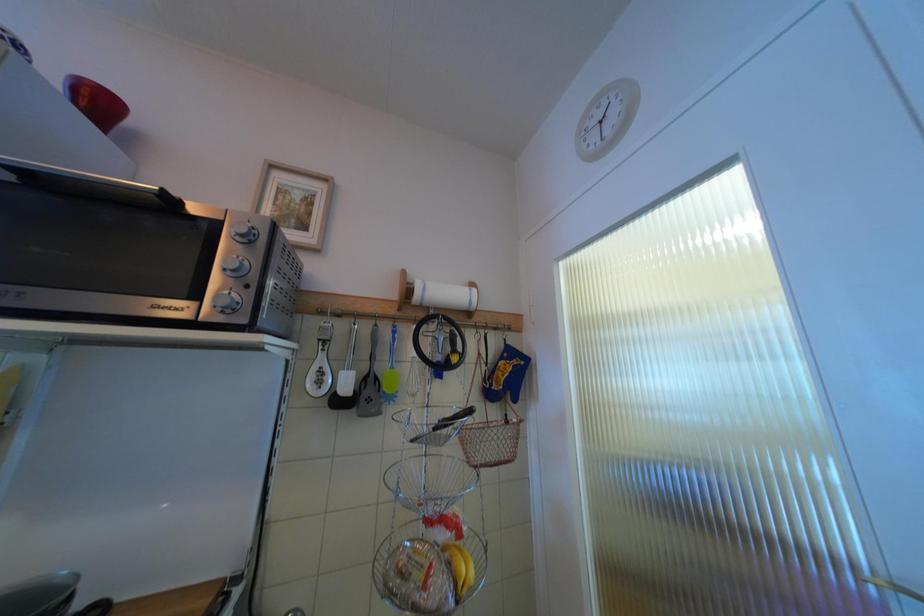
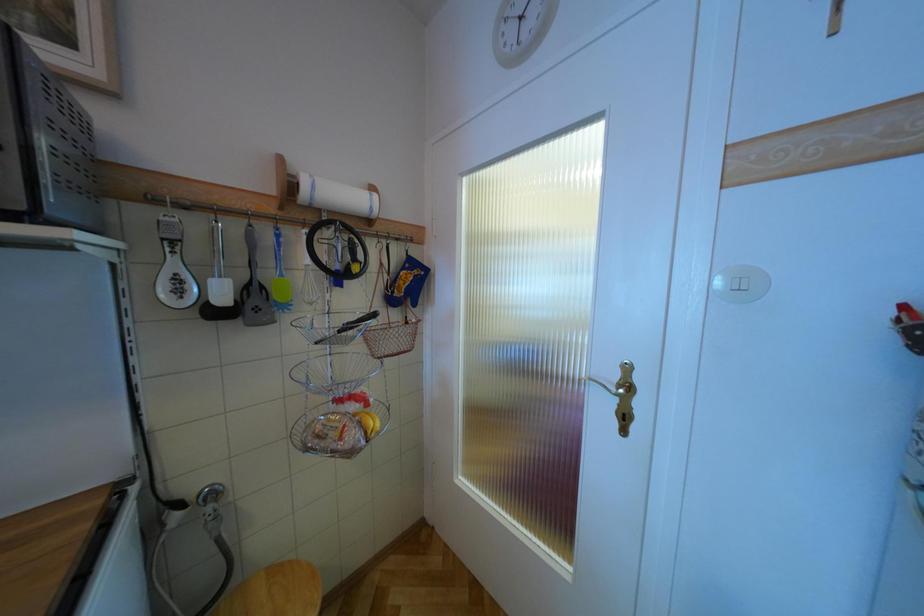
First-person continuous shooting, in which direction is the camera rotating?

The camera rotated toward right-down.